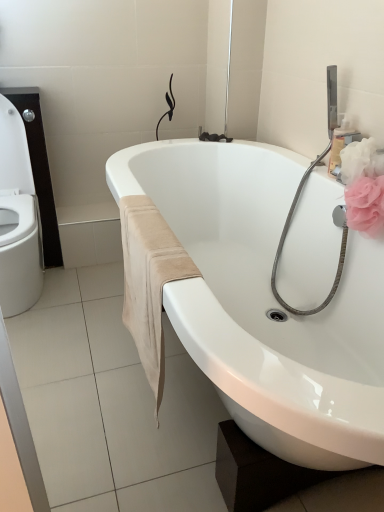
Question: Does black rubber faucet at upper center have a lesser height compared to white glossy bathtub at center?

Choices:
 (A) yes
 (B) no

Answer: (A)

Question: Is black rubber faucet at upper center smaller than white glossy bathtub at center?

Choices:
 (A) no
 (B) yes

Answer: (B)

Question: Does black rubber faucet at upper center have a greater width compared to white glossy bathtub at center?

Choices:
 (A) yes
 (B) no

Answer: (B)

Question: From a real-world perspective, is black rubber faucet at upper center positioned over white glossy bathtub at center based on gravity?

Choices:
 (A) no
 (B) yes

Answer: (B)

Question: Is white glossy bathtub at center surrounded by black rubber faucet at upper center?

Choices:
 (A) no
 (B) yes

Answer: (A)

Question: In the image, is pink fabric flower at upper right positioned in front of or behind black rubber faucet at upper center?

Choices:
 (A) front
 (B) behind

Answer: (A)

Question: Does point (367, 182) appear closer or farther from the camera than point (223, 138)?

Choices:
 (A) closer
 (B) farther

Answer: (A)

Question: Visually, is pink fabric flower at upper right positioned to the left or to the right of black rubber faucet at upper center?

Choices:
 (A) right
 (B) left

Answer: (A)

Question: Looking at the image, does pink fabric flower at upper right seem bigger or smaller compared to black rubber faucet at upper center?

Choices:
 (A) big
 (B) small

Answer: (A)

Question: From the image's perspective, is black rubber faucet at upper center positioned above or below pink fabric flower at upper right?

Choices:
 (A) below
 (B) above

Answer: (B)

Question: Looking at their shapes, would you say black rubber faucet at upper center is wider or thinner than pink fabric flower at upper right?

Choices:
 (A) thin
 (B) wide

Answer: (A)

Question: Looking at the image, does black rubber faucet at upper center seem bigger or smaller compared to pink fabric flower at upper right?

Choices:
 (A) small
 (B) big

Answer: (A)

Question: Considering the relative positions of black rubber faucet at upper center and pink fabric flower at upper right in the image provided, is black rubber faucet at upper center to the left or to the right of pink fabric flower at upper right?

Choices:
 (A) left
 (B) right

Answer: (A)

Question: Is black rubber faucet at upper center wider or thinner than beige suede towel at lower center?

Choices:
 (A) wide
 (B) thin

Answer: (B)

Question: Which is correct: black rubber faucet at upper center is inside beige suede towel at lower center, or outside of it?

Choices:
 (A) outside
 (B) inside

Answer: (A)